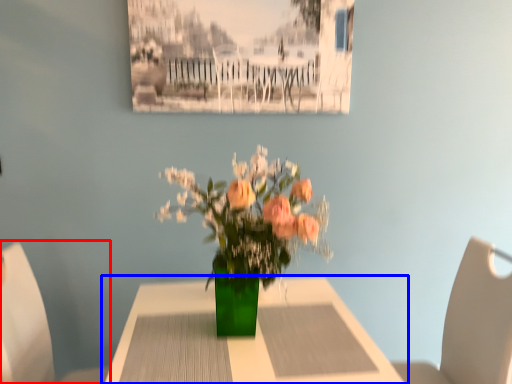
Question: Among these objects, which one is farthest to the camera, chair (highlighted by a red box) or table (highlighted by a blue box)?

Choices:
 (A) chair
 (B) table

Answer: (A)